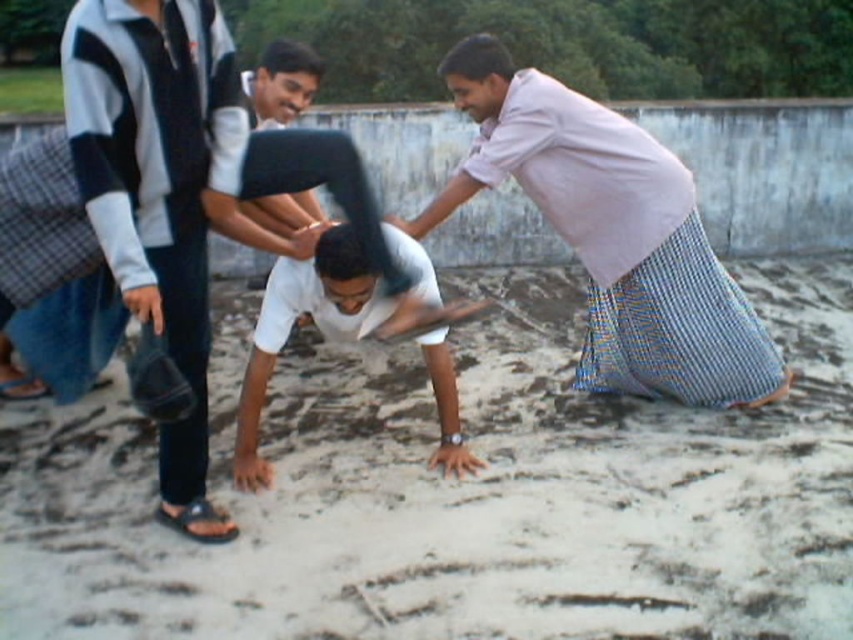
You are a photographer trying to capture a candid shot of the scene. You notice two white shirts in the image. Which one is bigger in size between the white matte shirt at center and the white cotton shirt at upper center?

The white matte shirt at center is larger in size compared to the white cotton shirt at upper center.

You are a photographer trying to capture a photo of the white sandy ground at center and the white matte shirt at center. Which object should you focus on first if you want to ensure both are in sharp focus, considering their sizes?

The white sandy ground at center is bigger than the white matte shirt at center, so focusing on the larger object first will help ensure both are in sharp focus.

You are a photographer trying to capture a wide shot of the scene. The light pink woven cloth at upper right and the blue woven cloth at right are in the background. Since you want both cloths to be clearly visible in the photo, which cloth should you focus on to ensure both are in focus?

The light pink woven cloth at upper right is larger in size compared to the blue woven cloth at right. To ensure both are in focus, focus on the light pink woven cloth at upper right since its larger size will be easier to focus on, and the depth of field will likely include the smaller blue woven cloth at right as well.